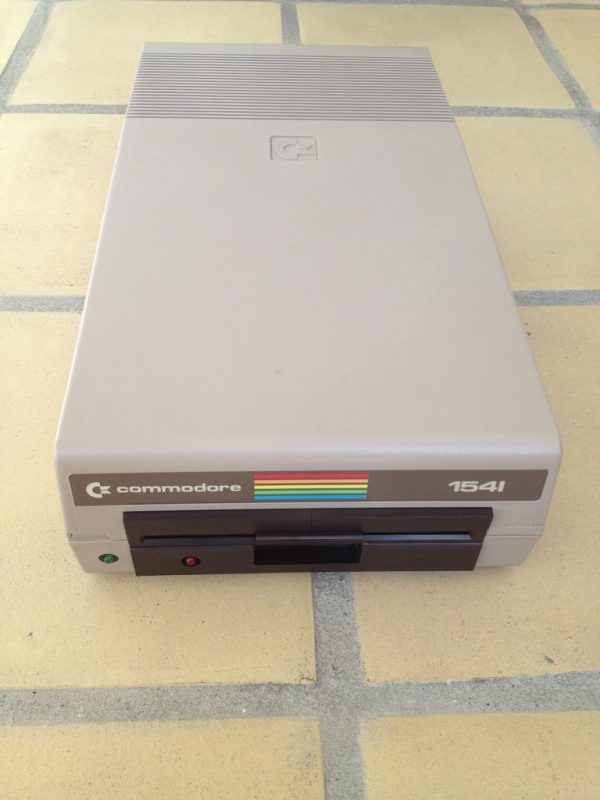
Image resolution: width=600 pixels, height=800 pixels. In order to click on green led in this screenshot , I will do `click(108, 561)`.